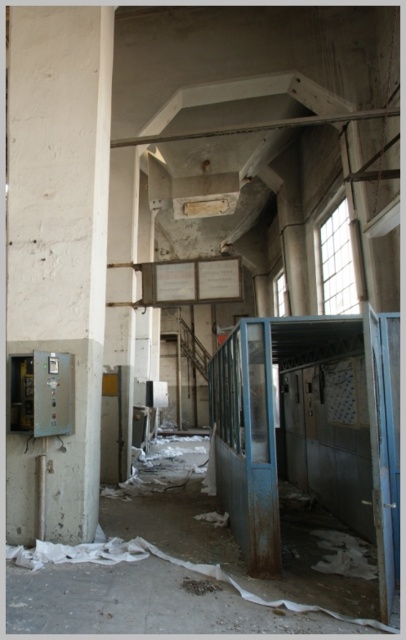
Question: Can you confirm if white concrete pillar at left is positioned above rusty metal debris at center?

Choices:
 (A) no
 (B) yes

Answer: (B)

Question: Which point is closer to the camera taking this photo?

Choices:
 (A) (203, 579)
 (B) (27, 536)

Answer: (A)

Question: From the image, what is the correct spatial relationship of white concrete pillar at left in relation to rusty metal debris at center?

Choices:
 (A) above
 (B) below

Answer: (A)

Question: Does white concrete pillar at left have a lesser width compared to rusty metal debris at center?

Choices:
 (A) yes
 (B) no

Answer: (B)

Question: Which of the following is the closest to the observer?

Choices:
 (A) white concrete pillar at left
 (B) rusty metal debris at center

Answer: (B)